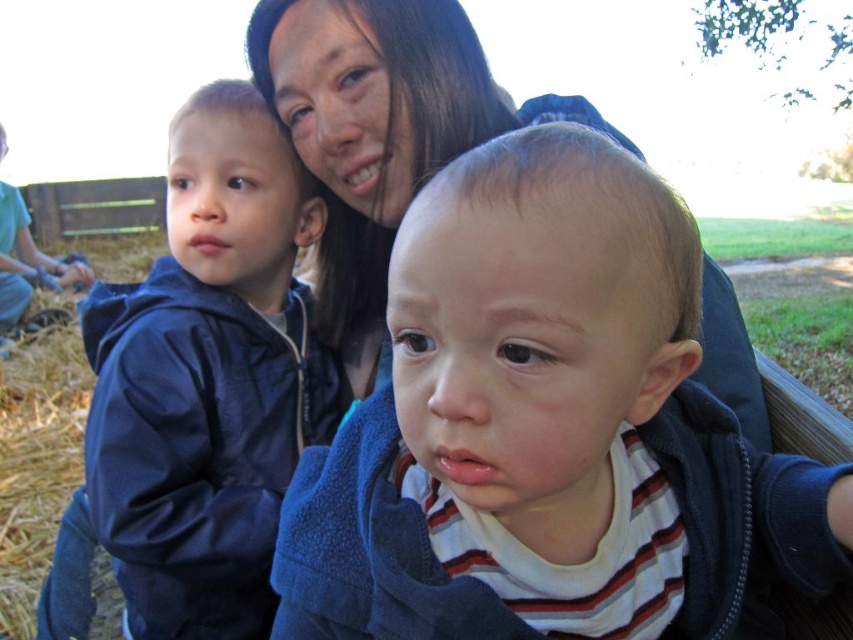
The width and height of the screenshot is (853, 640). What do you see at coordinates (544, 428) in the screenshot?
I see `matte blue hoodie at center` at bounding box center [544, 428].

Is matte blue hoodie at center smaller than dark blue jacket at left?

Correct, matte blue hoodie at center occupies less space than dark blue jacket at left.

Between point (503, 609) and point (260, 493), which one is positioned in front?

Point (503, 609) is more forward.

Image resolution: width=853 pixels, height=640 pixels. Find the location of `matte blue hoodie at center`. matte blue hoodie at center is located at coordinates (544, 428).

Does matte blue hoodie at center appear over smooth dark hair at center?

No, matte blue hoodie at center is not above smooth dark hair at center.

Between matte blue hoodie at center and smooth dark hair at center, which one has more height?

smooth dark hair at center is taller.

Where is `matte blue hoodie at center`? The width and height of the screenshot is (853, 640). matte blue hoodie at center is located at coordinates point(544,428).

Locate an element on the screen. matte blue hoodie at center is located at coordinates (544, 428).

Does dark blue jacket at left have a larger size compared to smooth dark hair at center?

No.

What do you see at coordinates (207, 378) in the screenshot? I see `dark blue jacket at left` at bounding box center [207, 378].

At what (x,y) coordinates should I click in order to perform the action: click on dark blue jacket at left. Please return your answer as a coordinate pair (x, y). Image resolution: width=853 pixels, height=640 pixels. Looking at the image, I should click on (207, 378).